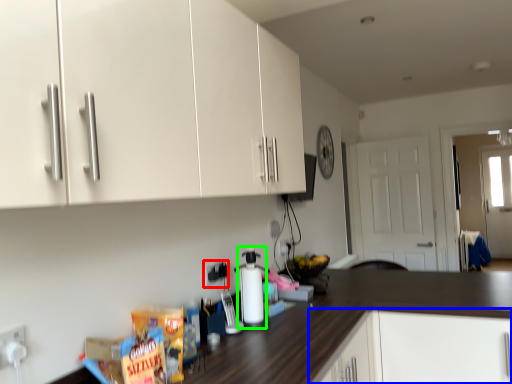
Question: Which object is the farthest from electric outlet (highlighted by a red box)? Choose among these: cabinetry (highlighted by a blue box) or bottle (highlighted by a green box).

Choices:
 (A) cabinetry
 (B) bottle

Answer: (A)